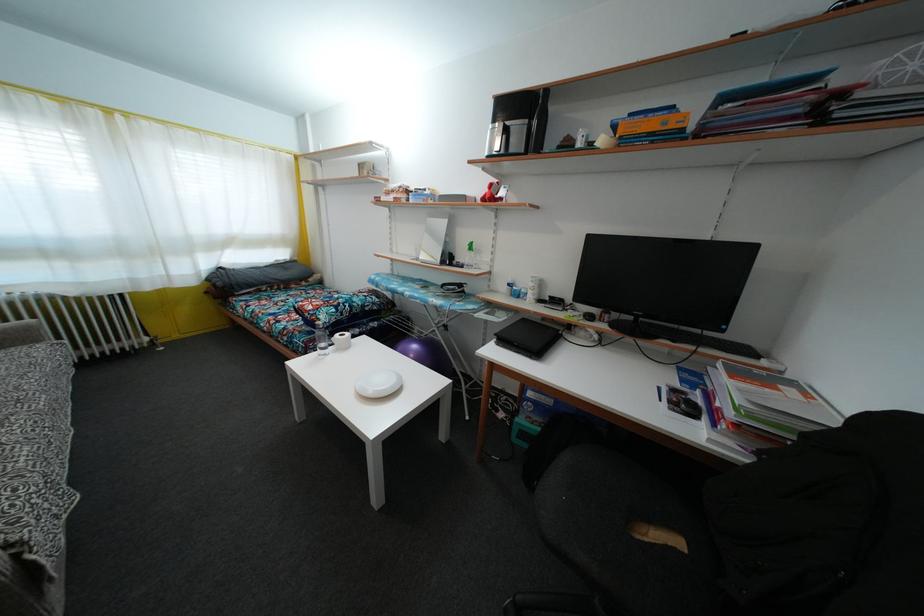
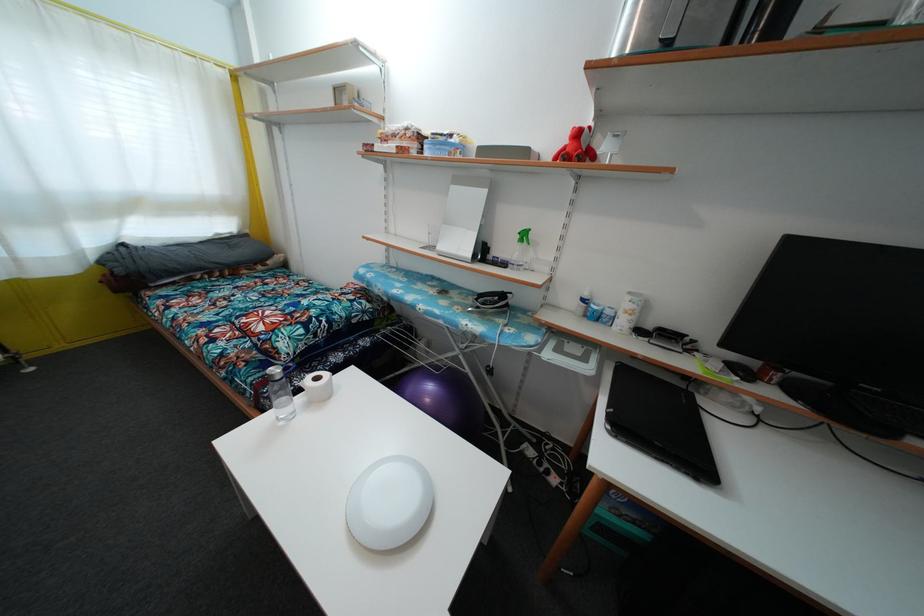
Find the pixel in the second image that matches pixel 475 253 in the first image.

(528, 241)